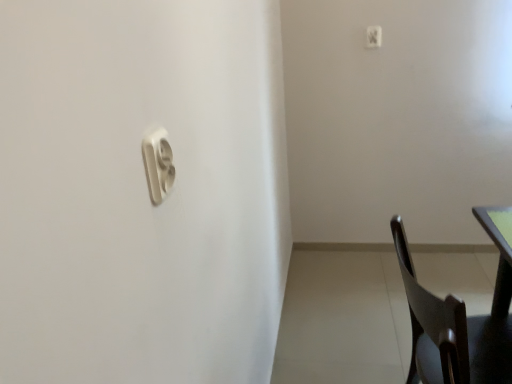
Question: Is point (x=478, y=210) closer or farther from the camera than point (x=501, y=344)?

Choices:
 (A) closer
 (B) farther

Answer: (B)

Question: From the image's perspective, relative to dark wood chair at lower right, is green matte table top at right above or below?

Choices:
 (A) above
 (B) below

Answer: (A)

Question: Estimate the real-world distances between objects in this image. Which object is closer to the dark wood chair at lower right?

Choices:
 (A) green matte table top at right
 (B) white plastic light switch at upper right, which ranks as the second light switch in left-to-right order
 (C) white plastic light switch at upper center, positioned as the 2th light switch in back-to-front order

Answer: (A)

Question: Which of these objects is positioned farthest from the white plastic light switch at upper center, the first light switch positioned from the bottom?

Choices:
 (A) green matte table top at right
 (B) white plastic light switch at upper right, which is counted as the first light switch, starting from the back
 (C) dark wood chair at lower right

Answer: (B)